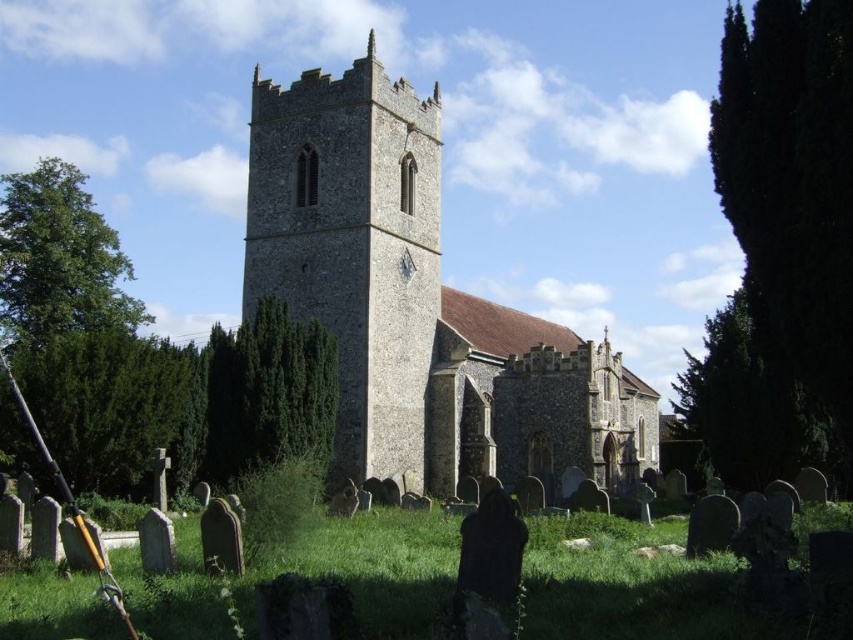
Question: Observing the image, what is the correct spatial positioning of brown stone church at center in reference to stone tower at center?

Choices:
 (A) left
 (B) right

Answer: (B)

Question: Which point is farther from the camera taking this photo?

Choices:
 (A) (379, 77)
 (B) (376, 305)

Answer: (A)

Question: Which point appears closest to the camera in this image?

Choices:
 (A) (276, 272)
 (B) (315, 198)

Answer: (B)

Question: Is brown stone church at center in front of stone tower at center?

Choices:
 (A) yes
 (B) no

Answer: (A)

Question: Can you confirm if brown stone church at center is positioned below stone tower at center?

Choices:
 (A) no
 (B) yes

Answer: (B)